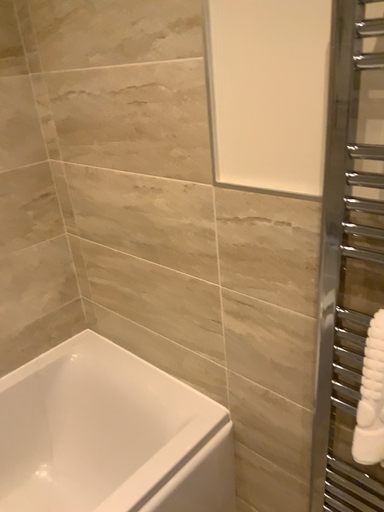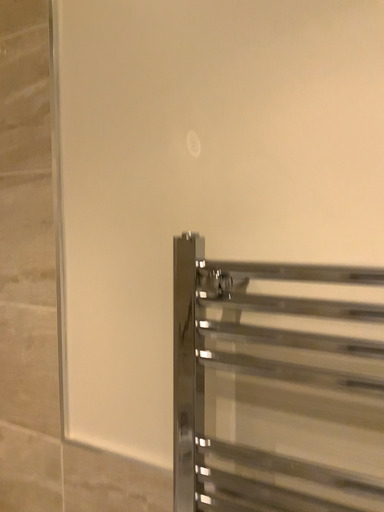
Question: How did the camera likely rotate when shooting the video?

Choices:
 (A) rotated left
 (B) rotated right

Answer: (B)